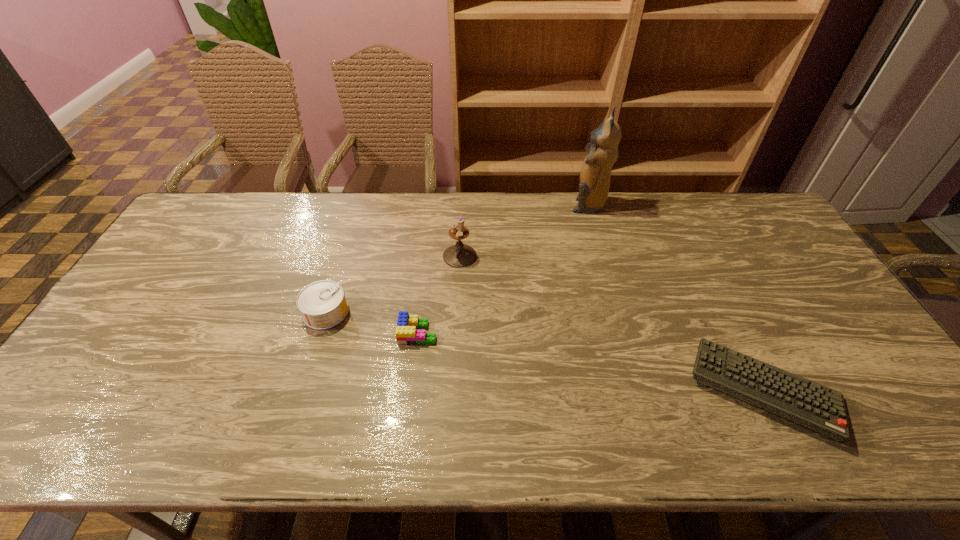
You are a GUI agent. You are given a task and a screenshot of the screen. Output one action in this format:
    pyautogui.click(x=<x>, y=<y>)
    Task: Click on the farthest object
    The image size is (960, 540).
    Given the screenshot: What is the action you would take?
    pyautogui.click(x=594, y=178)

Where is `cat`? The image size is (960, 540). cat is located at coordinates (594, 178).

At what (x,y) coordinates should I click in order to perform the action: click on candle holder. Please return your answer as a coordinate pair (x, y). Looking at the image, I should click on (460, 255).

This screenshot has width=960, height=540. What are the coordinates of `the second farthest object` in the screenshot? It's located at (460, 255).

Identify the location of the third shortest object. pos(323,305).

Where is `the leftmost object`? This screenshot has height=540, width=960. the leftmost object is located at coordinates (323, 305).

Where is `Lego`? Lego is located at coordinates (406, 333).

Locate an element on the screen. computer keyboard is located at coordinates (812, 405).

Locate an element on the screen. This screenshot has width=960, height=540. vacant space located 0.230m on the face of the tallest object is located at coordinates 506,205.

Image resolution: width=960 pixels, height=540 pixels. I want to click on vacant space situated 0.220m on the face of the tallest object, so click(x=509, y=205).